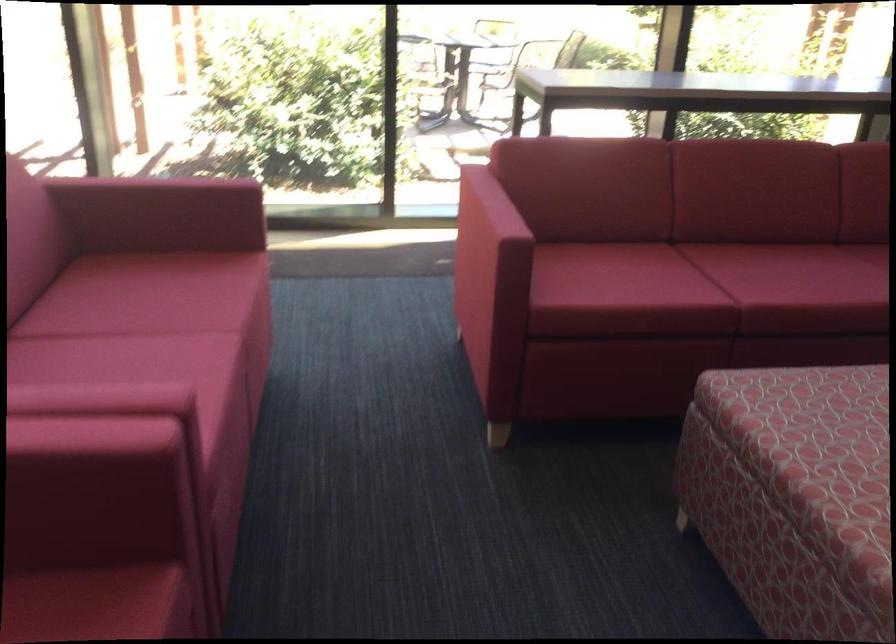
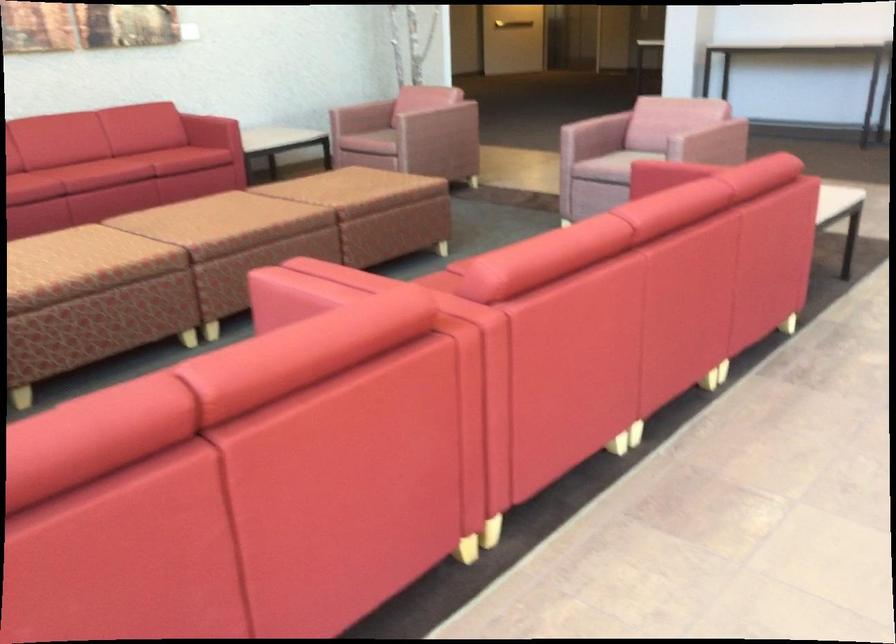
Find the pixel in the second image that matches point (804, 451) in the first image.

(83, 265)